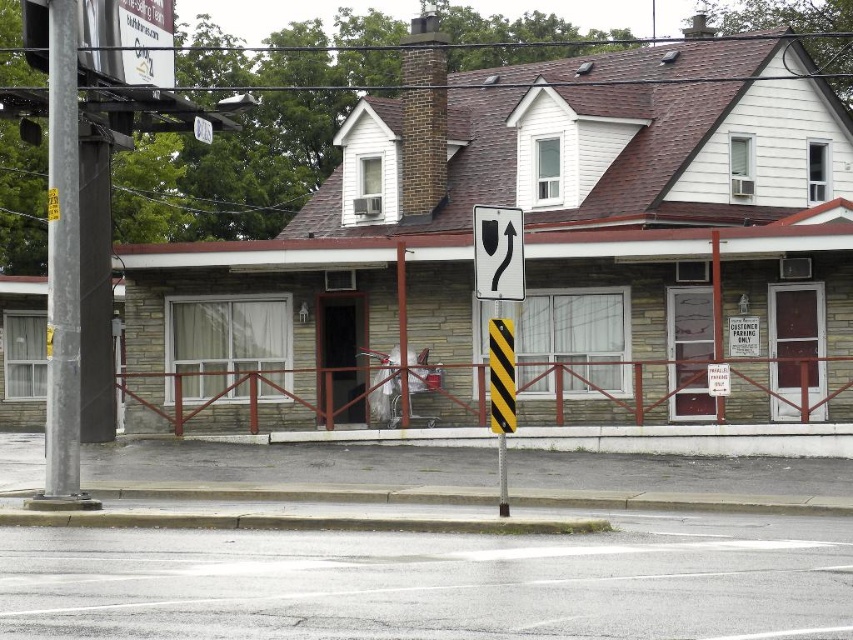
Does point (511, 211) come closer to viewer compared to point (505, 337)?

No, (511, 211) is behind (505, 337).

Between black plastic traffic sign at center and black/yellow striped post at center, which one appears on the left side from the viewer's perspective?

black plastic traffic sign at center is more to the left.

Find the location of a particular element. This screenshot has height=640, width=853. black plastic traffic sign at center is located at coordinates (498, 252).

Which is behind, point (77, 321) or point (520, 296)?

The point (77, 321) is more distant.

Measure the distance between metallic gray pole at left and camera.

They are 16.09 meters apart.

What are the coordinates of `metallic gray pole at left` in the screenshot? It's located at (62, 262).

Does asphalt at lower center have a lesser height compared to metallic gray pole at left?

Yes.

Is point (195, 540) farther from viewer compared to point (71, 3)?

No.

This screenshot has width=853, height=640. What are the coordinates of `asphalt at lower center` in the screenshot? It's located at (431, 582).